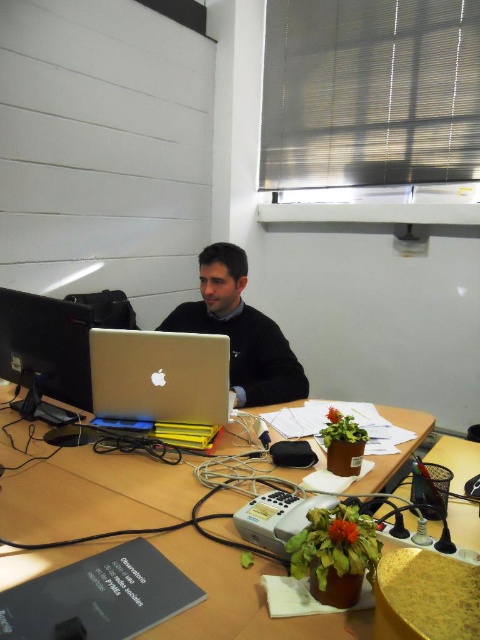
Is matte black sweater at center behind matte black monitor at left?

Yes, it is behind matte black monitor at left.

Can you confirm if matte black sweater at center is bigger than matte black monitor at left?

Correct, matte black sweater at center is larger in size than matte black monitor at left.

I want to click on matte black sweater at center, so click(240, 332).

Does silver metallic laptop at center have a smaller size compared to matte black sweater at center?

Indeed, silver metallic laptop at center has a smaller size compared to matte black sweater at center.

From the picture: Can you confirm if silver metallic laptop at center is positioned to the left of matte black sweater at center?

Yes, silver metallic laptop at center is to the left of matte black sweater at center.

Is point (106, 333) in front of point (231, 328)?

Yes, it is.

Find the location of a particular element. The image size is (480, 640). silver metallic laptop at center is located at coordinates (159, 376).

Is point (26, 472) in front of point (1, 324)?

Yes, point (26, 472) is in front of point (1, 324).

Does point (78, 516) come farther from viewer compared to point (16, 316)?

No, it is not.

Find the location of a particular element. wooden at center is located at coordinates (93, 496).